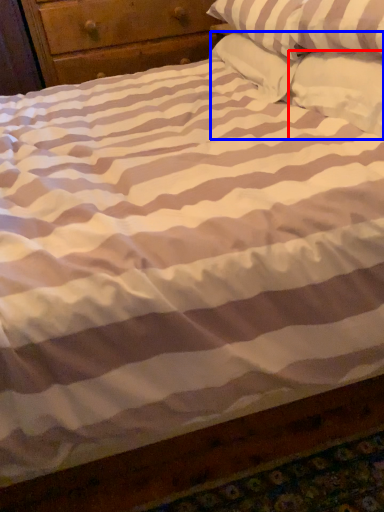
Question: Which point is closer to the camera, pillow (highlighted by a red box) or pillow (highlighted by a blue box)?

Choices:
 (A) pillow
 (B) pillow

Answer: (A)